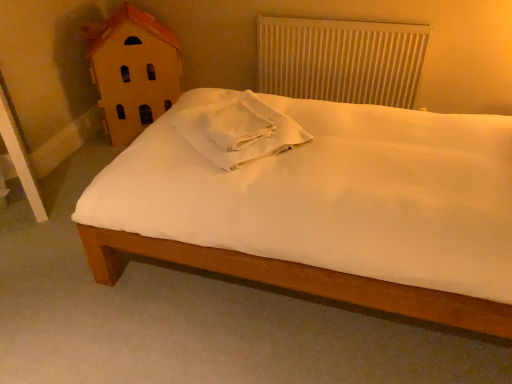
Question: From the image's perspective, is white matte bed at center under white textured radiator at upper center?

Choices:
 (A) yes
 (B) no

Answer: (A)

Question: Can white textured radiator at upper center be found inside white matte bed at center?

Choices:
 (A) no
 (B) yes

Answer: (A)

Question: Is white matte bed at center aimed at white textured radiator at upper center?

Choices:
 (A) yes
 (B) no

Answer: (B)

Question: From a real-world perspective, is white matte bed at center under white textured radiator at upper center?

Choices:
 (A) no
 (B) yes

Answer: (B)

Question: Is white matte bed at center to the right of white textured radiator at upper center from the viewer's perspective?

Choices:
 (A) yes
 (B) no

Answer: (B)

Question: Looking at their shapes, would you say wooden house at left is wider or thinner than white textured radiator at upper center?

Choices:
 (A) thin
 (B) wide

Answer: (B)

Question: Is wooden house at left in front of or behind white textured radiator at upper center in the image?

Choices:
 (A) behind
 (B) front

Answer: (B)

Question: From a real-world perspective, is wooden house at left above or below white textured radiator at upper center?

Choices:
 (A) below
 (B) above

Answer: (A)

Question: From their relative heights in the image, would you say wooden house at left is taller or shorter than white textured radiator at upper center?

Choices:
 (A) tall
 (B) short

Answer: (A)

Question: In the image, is white textured radiator at upper center positioned in front of or behind white cotton towel at center?

Choices:
 (A) behind
 (B) front

Answer: (A)

Question: From a real-world perspective, is white textured radiator at upper center positioned above or below white cotton towel at center?

Choices:
 (A) above
 (B) below

Answer: (B)

Question: Considering the positions of point (358, 41) and point (217, 125), is point (358, 41) closer or farther from the camera than point (217, 125)?

Choices:
 (A) closer
 (B) farther

Answer: (B)

Question: Looking at the image, does white textured radiator at upper center seem bigger or smaller compared to white cotton towel at center?

Choices:
 (A) big
 (B) small

Answer: (A)

Question: Relative to white cotton towel at center, is white matte bed at center in front or behind?

Choices:
 (A) front
 (B) behind

Answer: (A)

Question: In terms of height, does white matte bed at center look taller or shorter compared to white cotton towel at center?

Choices:
 (A) short
 (B) tall

Answer: (A)